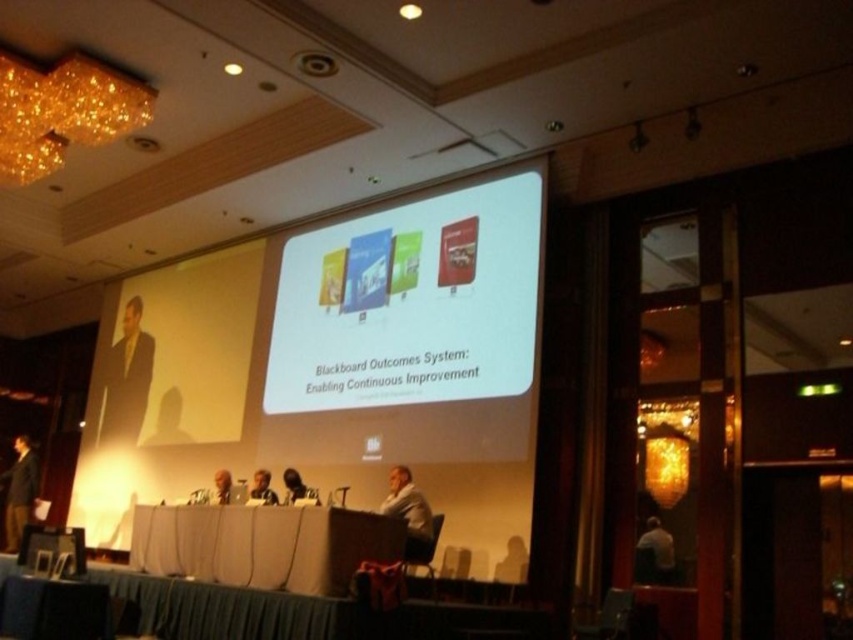
Question: Is white glossy projection screen at upper center below light gray suit at center?

Choices:
 (A) yes
 (B) no

Answer: (B)

Question: Estimate the real-world distances between objects in this image. Which object is closer to the dark brown leather jacket at center?

Choices:
 (A) white glossy projection screen at center
 (B) dark suit at left
 (C) white fabric table at center
 (D) light brown leather jacket at center

Answer: (D)

Question: Does matte black suit at left have a lesser width compared to light brown leather jacket at center?

Choices:
 (A) no
 (B) yes

Answer: (A)

Question: Can you confirm if silhouette figure at lower center is positioned above smooth skin face at center?

Choices:
 (A) yes
 (B) no

Answer: (B)

Question: Among these objects, which one is nearest to the camera?

Choices:
 (A) matte black suit at left
 (B) silhouette figure at lower center

Answer: (B)

Question: Which object appears farthest from the camera in this image?

Choices:
 (A) silhouette figure at lower center
 (B) white glossy projection screen at center
 (C) dark suit at left

Answer: (C)